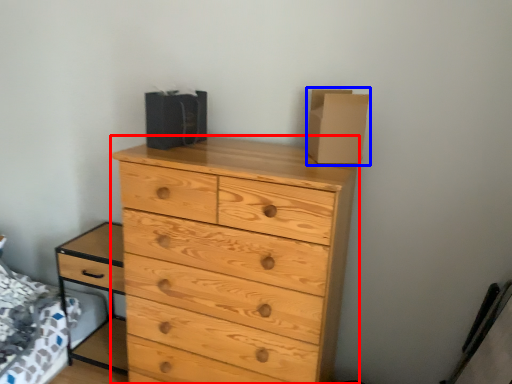
Question: Which object is further to the camera taking this photo, chest of drawers (highlighted by a red box) or cardboard box (highlighted by a blue box)?

Choices:
 (A) chest of drawers
 (B) cardboard box

Answer: (B)